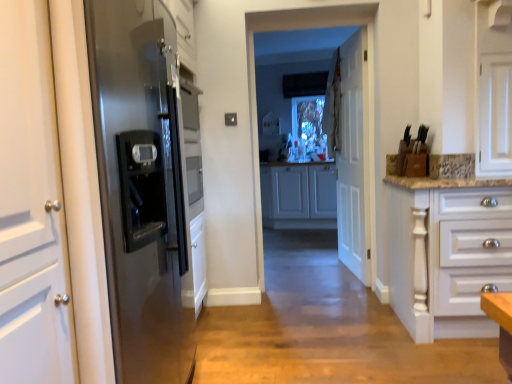
The height and width of the screenshot is (384, 512). Find the location of `vacant region below clear glass window at center (from a real-world perspective)`. vacant region below clear glass window at center (from a real-world perspective) is located at coordinates (321, 288).